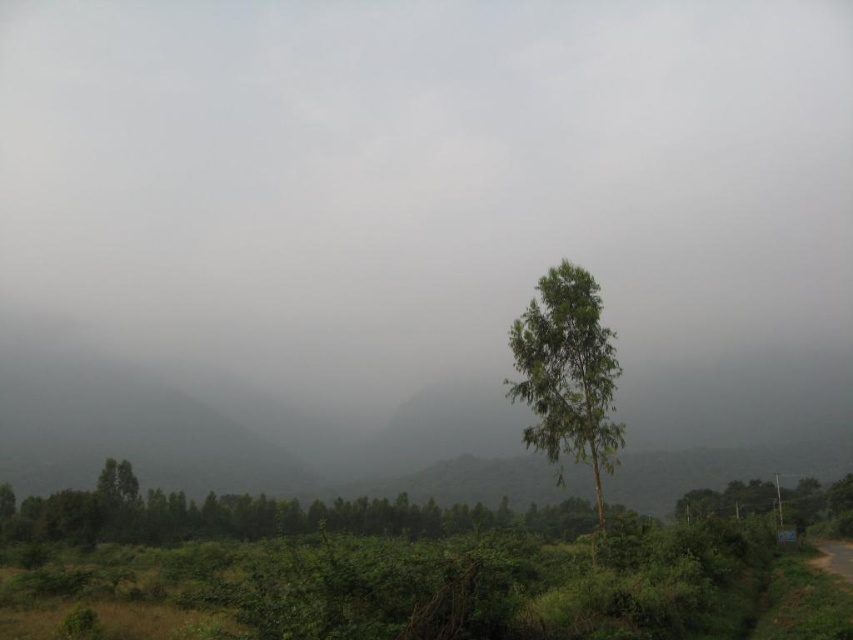
Does green leafy tree at center have a smaller size compared to green leafy tree at lower right?

Yes.

Is green leafy tree at center positioned at the back of green leafy tree at lower right?

No, it is in front of green leafy tree at lower right.

Does point (590, 413) come farther from viewer compared to point (842, 513)?

No, (590, 413) is in front of (842, 513).

Locate an element on the screen. The height and width of the screenshot is (640, 853). green leafy tree at center is located at coordinates (567, 374).